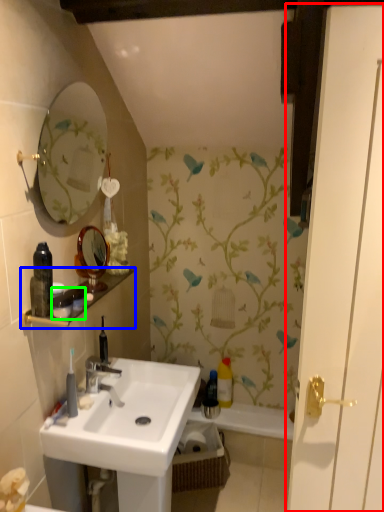
Question: Considering the real-world distances, which object is closest to door (highlighted by a red box)? balustrade (highlighted by a blue box) or toiletry (highlighted by a green box).

Choices:
 (A) balustrade
 (B) toiletry

Answer: (B)